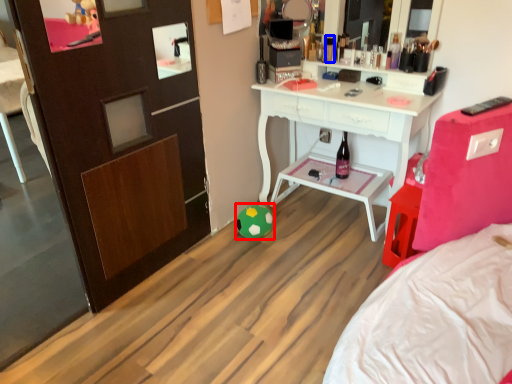
Question: Which object appears closest to the camera in this image, toy (highlighted by a red box) or toiletry (highlighted by a blue box)?

Choices:
 (A) toy
 (B) toiletry

Answer: (A)